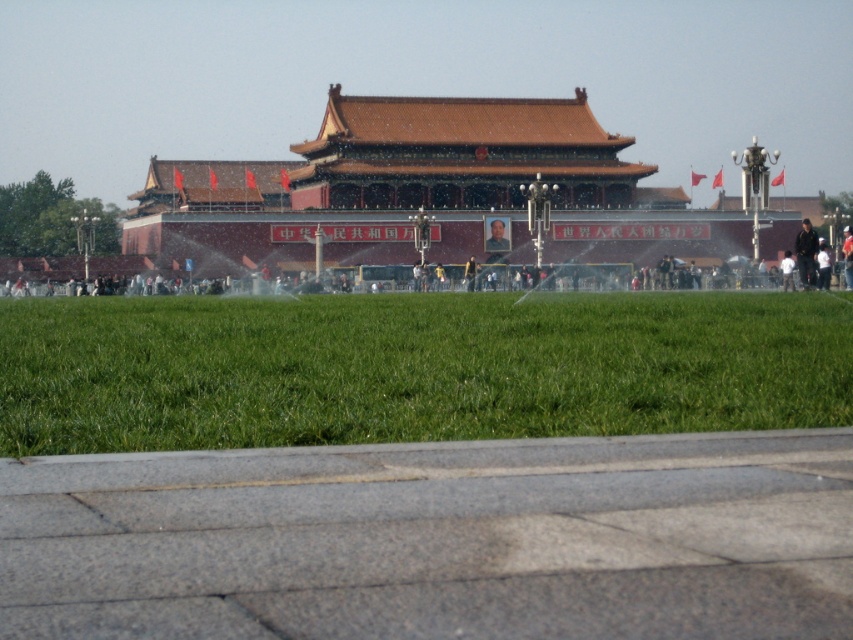
You are a visitor standing in front of the brown wooden palace at center and the dark gray fabric jacket at right. Which object is closer to you?

The dark gray fabric jacket at right is closer to you because the brown wooden palace at center is positioned over it, indicating it is further away.

You are a photographer planning to take a photo of the traditional Chinese building with both the dark gray fabric jacket at right and the light brown leather jacket at right in the frame. If you want to ensure both jackets are fully visible, which jacket should you focus on to avoid cropping either?

You should focus on the light brown leather jacket at right because it is wider than the dark gray fabric jacket at right, ensuring both are fully visible without cropping.